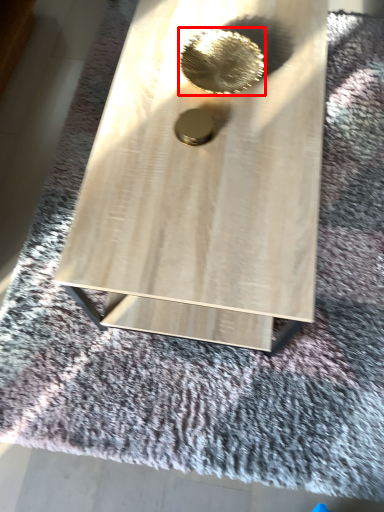
Question: From the image's perspective, where is hole (annotated by the red box) located in relation to hole in the image?

Choices:
 (A) above
 (B) below

Answer: (A)